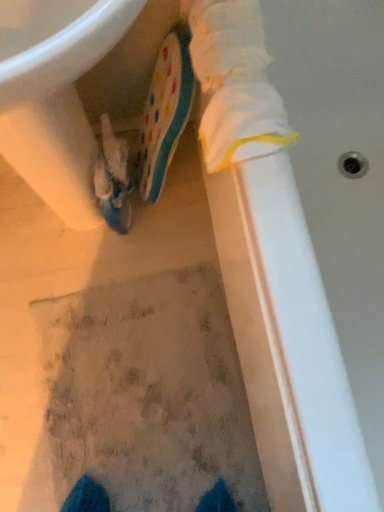
Question: Does textured gray mat at center turn towards white glossy sink at upper left?

Choices:
 (A) no
 (B) yes

Answer: (A)

Question: Can you confirm if textured gray mat at center is positioned to the right of white glossy sink at upper left?

Choices:
 (A) no
 (B) yes

Answer: (B)

Question: From a real-world perspective, does textured gray mat at center stand above white glossy sink at upper left?

Choices:
 (A) no
 (B) yes

Answer: (A)

Question: Is textured gray mat at center surrounding white glossy sink at upper left?

Choices:
 (A) yes
 (B) no

Answer: (B)

Question: Considering the relative sizes of textured gray mat at center and white glossy sink at upper left in the image provided, is textured gray mat at center taller than white glossy sink at upper left?

Choices:
 (A) no
 (B) yes

Answer: (A)

Question: Does point tap(11, 35) appear closer or farther from the camera than point tap(23, 501)?

Choices:
 (A) farther
 (B) closer

Answer: (B)

Question: Is white glossy sink at upper left bigger or smaller than textured gray mat at center?

Choices:
 (A) small
 (B) big

Answer: (B)

Question: Considering their positions, is white glossy sink at upper left located in front of or behind textured gray mat at center?

Choices:
 (A) behind
 (B) front

Answer: (B)

Question: In the image, is white glossy sink at upper left on the left side or the right side of textured gray mat at center?

Choices:
 (A) left
 (B) right

Answer: (A)

Question: Is textured gray mat at center taller or shorter than matte blue shoe at center, the 2th footwear when ordered from right to left?

Choices:
 (A) short
 (B) tall

Answer: (A)

Question: From a real-world perspective, is textured gray mat at center physically located above or below matte blue shoe at center, which ranks as the first footwear in left-to-right order?

Choices:
 (A) below
 (B) above

Answer: (A)

Question: Would you say textured gray mat at center is to the left or to the right of matte blue shoe at center, the 2th footwear when ordered from right to left, in the picture?

Choices:
 (A) left
 (B) right

Answer: (A)

Question: Is textured gray mat at center spatially inside matte blue shoe at center, the 2th footwear when ordered from right to left, or outside of it?

Choices:
 (A) outside
 (B) inside

Answer: (A)

Question: Would you say polka dot rubber boot at center, the 2th footwear from the left, is inside or outside textured gray mat at center?

Choices:
 (A) inside
 (B) outside

Answer: (B)

Question: Is polka dot rubber boot at center, the 2th footwear from the left, wider or thinner than textured gray mat at center?

Choices:
 (A) thin
 (B) wide

Answer: (A)